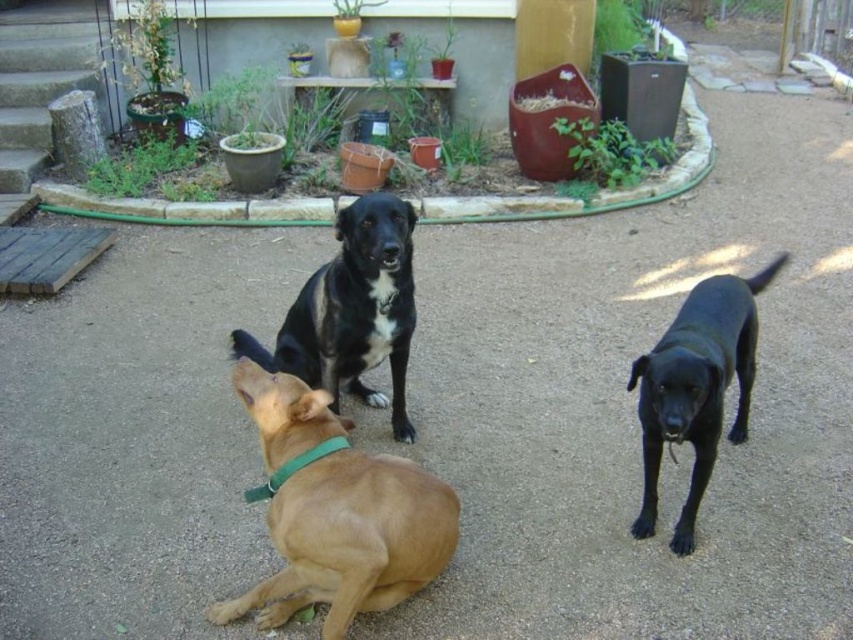
Does point (358, 472) come farther from viewer compared to point (402, 240)?

That is False.

Does golden fur dog at center appear on the right side of black matte dog at center?

Indeed, golden fur dog at center is positioned on the right side of black matte dog at center.

Does point (409, 545) come farther from viewer compared to point (347, 364)?

That is False.

Locate an element on the screen. The height and width of the screenshot is (640, 853). golden fur dog at center is located at coordinates (351, 540).

Based on the photo, between black matte dog at center and black glossy dog at center, which one has less height?

black matte dog at center is shorter.

Does black matte dog at center appear on the right side of black glossy dog at center?

Incorrect, black matte dog at center is not on the right side of black glossy dog at center.

This screenshot has height=640, width=853. In order to click on black matte dog at center in this screenshot , I will do [352, 310].

In order to click on black matte dog at center in this screenshot , I will do pyautogui.click(x=352, y=310).

Can you confirm if golden fur dog at center is shorter than black glossy dog at center?

Yes, golden fur dog at center is shorter than black glossy dog at center.

Does golden fur dog at center have a greater height compared to black glossy dog at center?

No, golden fur dog at center is not taller than black glossy dog at center.

Identify the location of golden fur dog at center. The image size is (853, 640). (351, 540).

The width and height of the screenshot is (853, 640). Find the location of `golden fur dog at center`. golden fur dog at center is located at coordinates (351, 540).